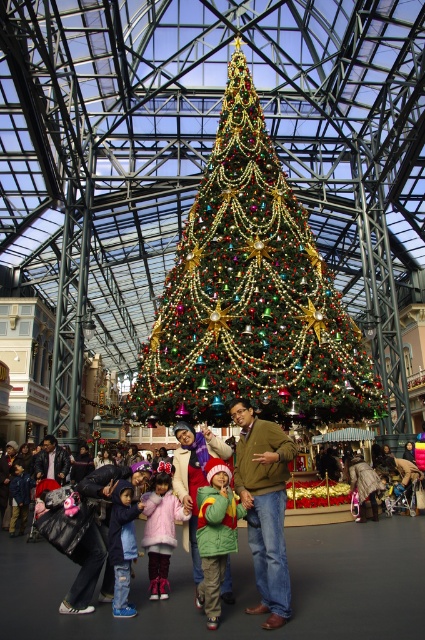
You are a photographer standing at the entrance of the mall. You want to take a photo of the Christmas tree while including both the green fuzzy coat at center and the matte blue jacket at lower left in the frame. Which person should you focus on to ensure both are visible in the photo?

Since the green fuzzy coat at center is taller than the matte blue jacket at lower left, focusing on the green fuzzy coat at center will ensure both are visible in the photo.

You are a photographer standing at the back of the mall and want to take a photo of the Christmas tree. You notice two coats hanging on a rack near the tree. One is a matte green coat at center and the other is a fuzzy pink coat at center. Which coat is shorter in height?

The matte green coat at center is not as tall as the fuzzy pink coat at center, so the matte green coat at center is shorter in height.